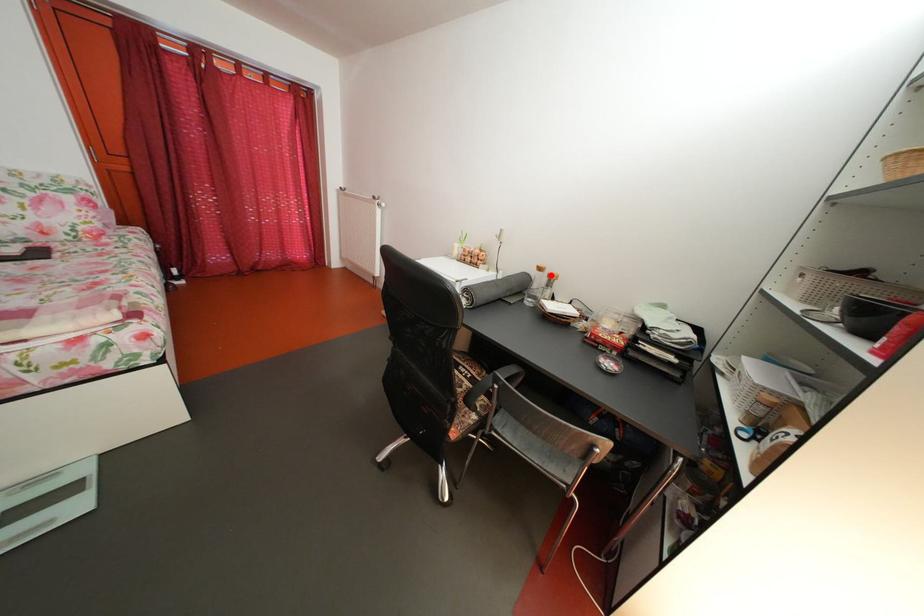
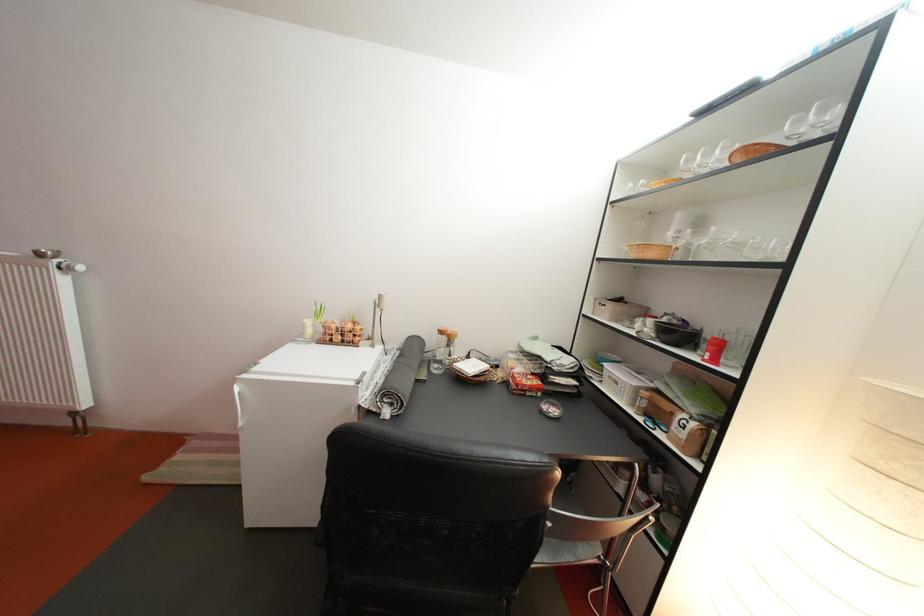
Find the pixel in the second image that matches the highlighted location in the first image.

(453, 339)